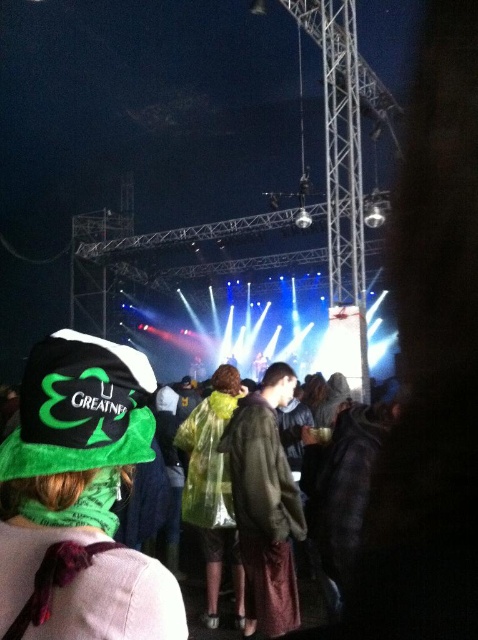
Which is behind, point (60, 557) or point (271, 387)?

The point (271, 387) is behind.

Does point (94, 499) come closer to viewer compared to point (245, 490)?

That is True.

In order to click on green fabric hat at lower left in this screenshot , I will do `click(79, 497)`.

Does green fabric jacket at center come in front of transparent plastic poncho at center?

Yes, green fabric jacket at center is closer to the viewer.

Can you confirm if green fabric jacket at center is positioned to the right of transparent plastic poncho at center?

Correct, you'll find green fabric jacket at center to the right of transparent plastic poncho at center.

Who is more distant from viewer, (246, 580) or (205, 500)?

The point (205, 500) is behind.

Where is `green fabric jacket at center`? Image resolution: width=478 pixels, height=640 pixels. green fabric jacket at center is located at coordinates (264, 506).

Does point (52, 588) lie behind point (260, 604)?

No.

Does point (12, 573) lie behind point (279, 602)?

No, (12, 573) is in front of (279, 602).

The image size is (478, 640). I want to click on green fabric hat at upper left, so click(78, 499).